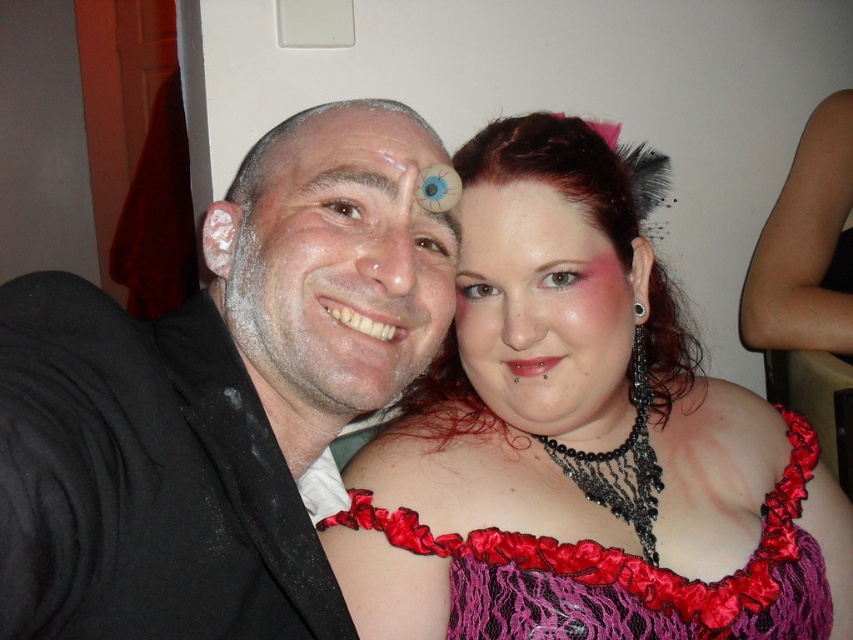
Who is lower down, pink matte makeup at center or brown hair at upper center?

pink matte makeup at center is lower down.

Does pink matte makeup at center appear under brown hair at upper center?

Correct, pink matte makeup at center is located below brown hair at upper center.

This screenshot has height=640, width=853. What do you see at coordinates (544, 308) in the screenshot?
I see `pink matte makeup at center` at bounding box center [544, 308].

Find the location of a particular element. Image resolution: width=853 pixels, height=640 pixels. pink matte makeup at center is located at coordinates 544,308.

Can you confirm if matte red lace dress at center is positioned below silky satin dress at center?

No, matte red lace dress at center is not below silky satin dress at center.

Can you confirm if matte red lace dress at center is bigger than silky satin dress at center?

Yes, matte red lace dress at center is bigger than silky satin dress at center.

Is point (418, 406) in front of point (456, 563)?

No, (418, 406) is further to viewer.

Image resolution: width=853 pixels, height=640 pixels. I want to click on matte red lace dress at center, so click(581, 442).

Who is shorter, matte red lace dress at center or brown hair at upper center?

Standing shorter between the two is brown hair at upper center.

Is matte red lace dress at center bigger than brown hair at upper center?

Yes.

Locate an element on the screen. Image resolution: width=853 pixels, height=640 pixels. matte red lace dress at center is located at coordinates (581, 442).